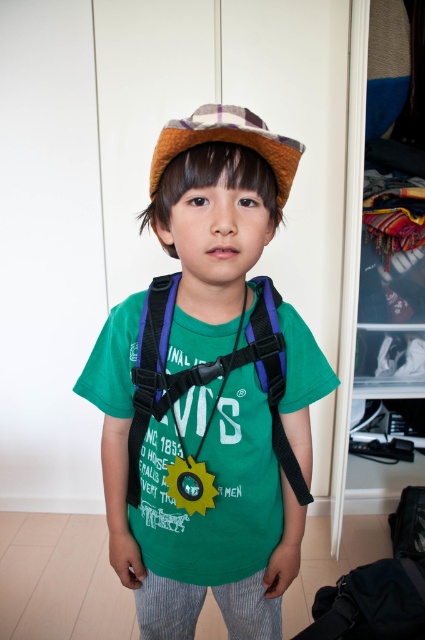
Based on the photo, the child is wearing a black backpack with purple straps and a yellow circular badge. There is also a point marked at coordinates (207,372). What does this point represent?

The point at (207,372) represents the purple fabric strap at center.